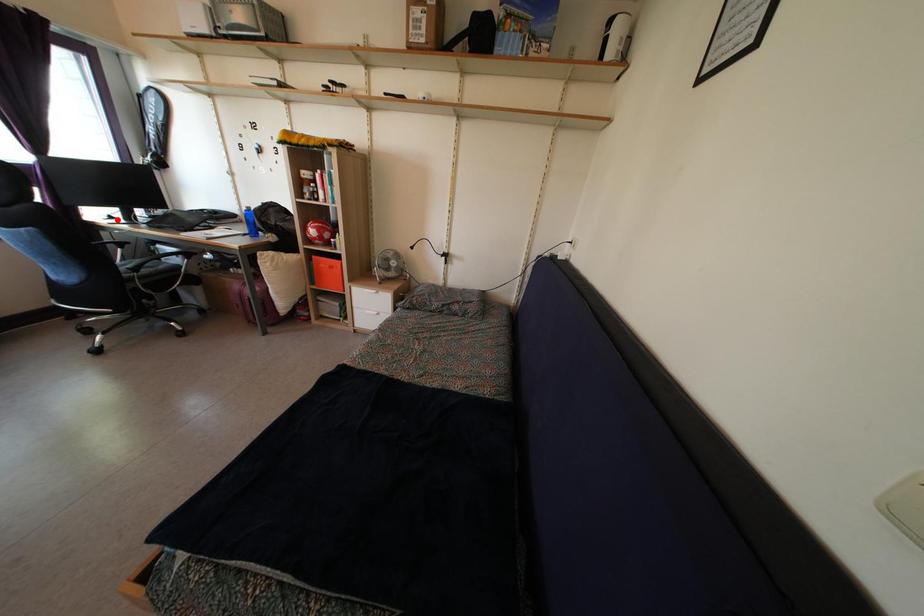
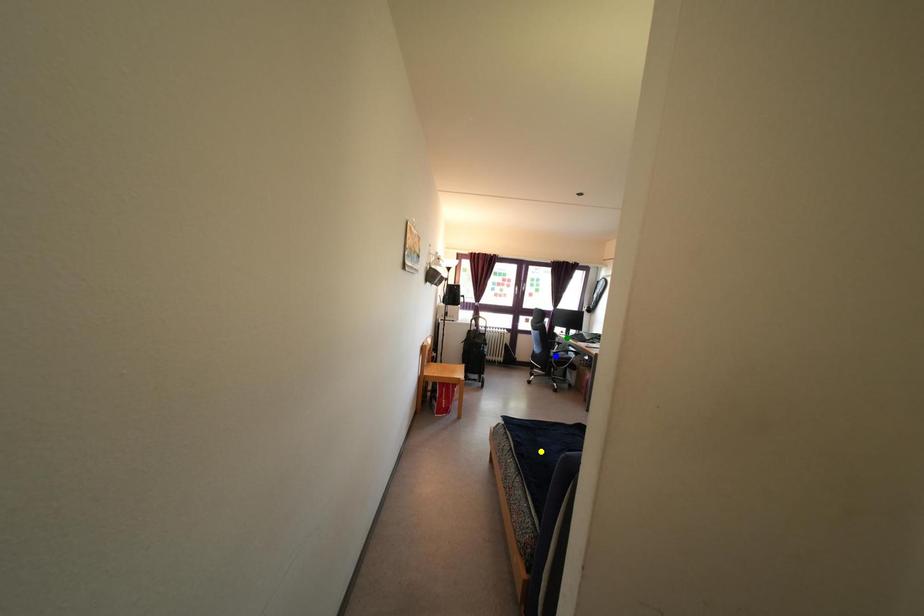
Question: I am providing you with two images of the same scene from different viewpoints. A red point is marked on the first image. You are given multiple points on the second image. Which mark in image 2 goes with the point in image 1?

Choices:
 (A) blue point
 (B) yellow point
 (C) green point

Answer: (C)